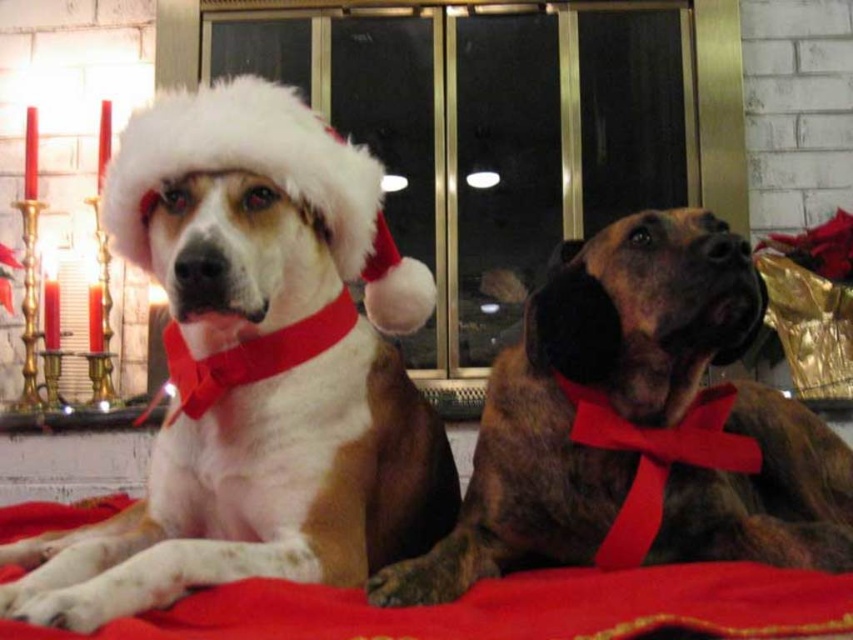
You are a photographer setting up a holiday photo shoot. You need to ensure that the white fur dog at center and the white fluffy santa hat at upper left are both visible in the frame. Given their sizes, which object will require more space in the composition?

The white fur dog at center requires more space in the composition because it has a larger size compared to the white fluffy santa hat at upper left.

You are a guest at a holiday party and see the red fabric blanket at lower center and the white fluffy Santa hat at upper left. Which object is located to the right of the other?

The red fabric blanket at lower center is positioned on the right side of the white fluffy Santa hat at upper left.